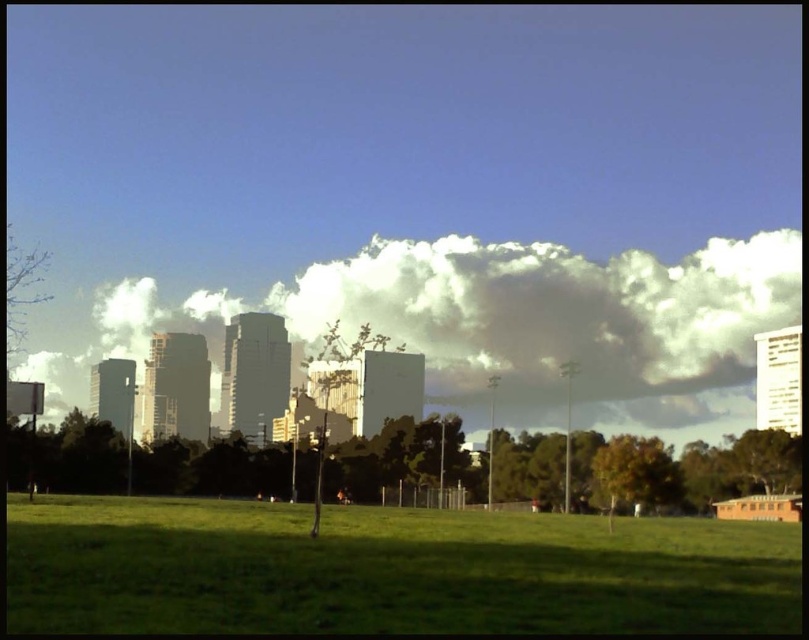
Question: Among these points, which one is farthest from the camera?

Choices:
 (A) tap(782, 572)
 (B) tap(524, 397)

Answer: (B)

Question: Which of the following is the closest to the observer?

Choices:
 (A) white fluffy cloud at upper center
 (B) green grassy field at lower center

Answer: (B)

Question: Is green grassy field at lower center further to the viewer compared to white fluffy cloud at upper center?

Choices:
 (A) yes
 (B) no

Answer: (B)

Question: Does green grassy field at lower center appear under white fluffy cloud at upper center?

Choices:
 (A) yes
 (B) no

Answer: (A)

Question: Can you confirm if green grassy field at lower center is positioned to the right of white fluffy cloud at upper center?

Choices:
 (A) no
 (B) yes

Answer: (A)